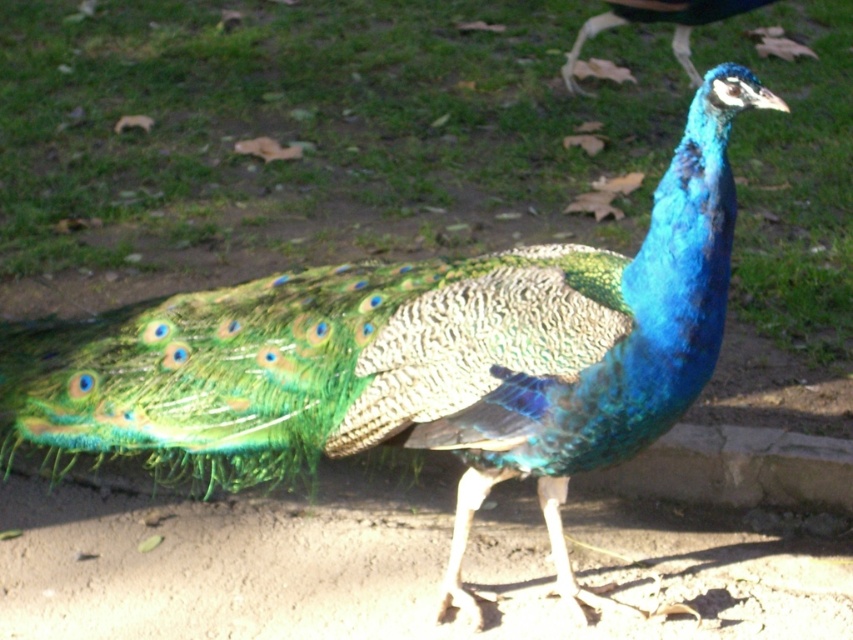
Which is more to the right, green textured grass at center or blue iridescent feathers at upper center?

blue iridescent feathers at upper center

Which is behind, point (828, 3) or point (682, 19)?

Positioned behind is point (828, 3).

You are a GUI agent. You are given a task and a screenshot of the screen. Output one action in this format:
    pyautogui.click(x=<x>, y=<y>)
    Task: Click on the green textured grass at center
    
    Given the screenshot: What is the action you would take?
    pyautogui.click(x=305, y=131)

Identify the location of green textured grass at center. (305, 131).